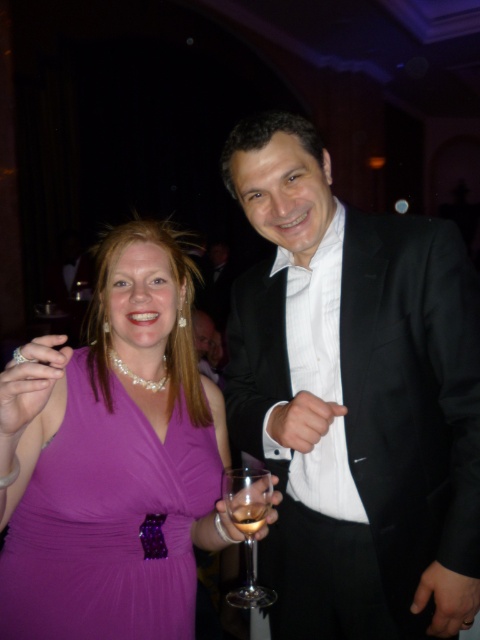
Question: Can you confirm if black satin suit at right is smaller than clear glass wine glass at center?

Choices:
 (A) no
 (B) yes

Answer: (A)

Question: Which point appears farthest from the camera in this image?

Choices:
 (A) (192, 548)
 (B) (242, 529)

Answer: (A)

Question: Is purple satin dress at center to the right of translucent glass wine at center from the viewer's perspective?

Choices:
 (A) no
 (B) yes

Answer: (A)

Question: Among these points, which one is nearest to the camera?

Choices:
 (A) (313, 438)
 (B) (251, 536)
 (C) (239, 522)
 (D) (180, 467)

Answer: (C)

Question: Which of these objects is positioned farthest from the translucent glass wine at center?

Choices:
 (A) purple satin dress at center
 (B) black satin suit at right

Answer: (B)

Question: Is purple satin dress at center wider than clear glass wine glass at center?

Choices:
 (A) yes
 (B) no

Answer: (A)